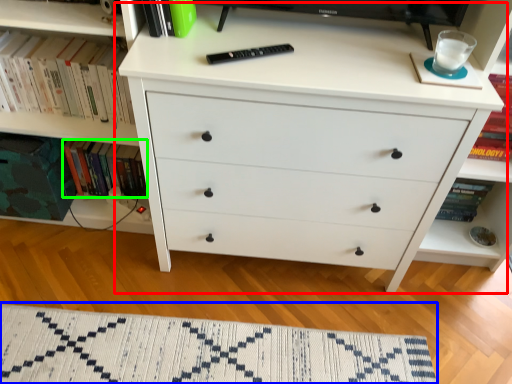
Question: Which object is positioned closest to chest of drawers (highlighted by a red box)? Select from mat (highlighted by a blue box) and book (highlighted by a green box).

Choices:
 (A) mat
 (B) book

Answer: (A)